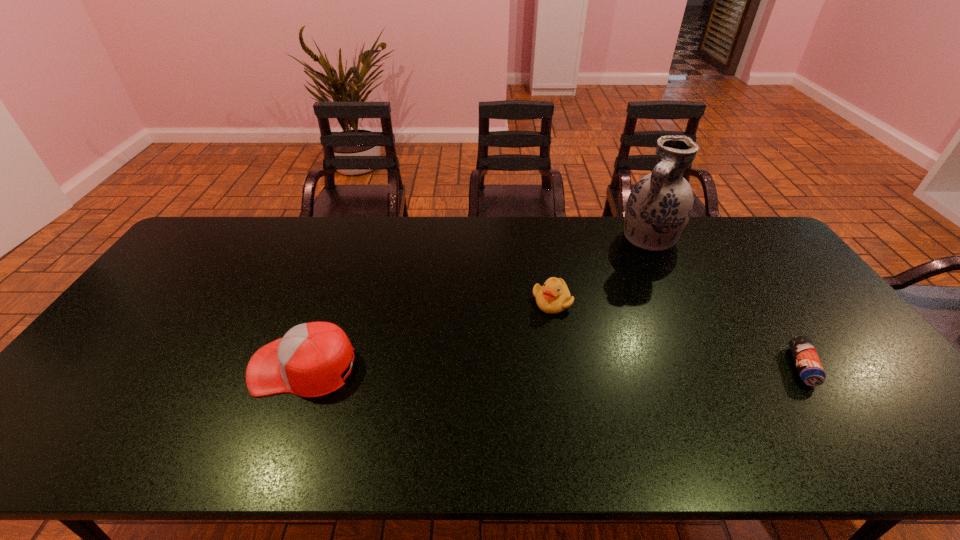
You are a GUI agent. You are given a task and a screenshot of the screen. Output one action in this format:
    pyautogui.click(x=<x>, y=<y>)
    Task: Click on the vacant area that lies between the tallest object and the third shortest object
    This screenshot has height=540, width=960.
    Given the screenshot: What is the action you would take?
    pyautogui.click(x=476, y=302)

You are a GUI agent. You are given a task and a screenshot of the screen. Output one action in this format:
    pyautogui.click(x=<x>, y=<y>)
    Task: Click on the vacant space in between the second farthest object and the shortest object
    
    Given the screenshot: What is the action you would take?
    pyautogui.click(x=677, y=334)

At what (x,y) coordinates should I click in order to perform the action: click on unoccupied position between the rightmost object and the vase. Please return your answer as a coordinate pair (x, y). The image size is (960, 540). Looking at the image, I should click on (726, 302).

You are a GUI agent. You are given a task and a screenshot of the screen. Output one action in this format:
    pyautogui.click(x=<x>, y=<y>)
    Task: Click on the vacant space that is in between the beer can and the second tallest object
    This screenshot has height=540, width=960.
    Given the screenshot: What is the action you would take?
    pyautogui.click(x=553, y=367)

Image resolution: width=960 pixels, height=540 pixels. In order to click on vacant space that is in between the farthest object and the third nearest object in this screenshot , I will do `click(601, 269)`.

In order to click on free spot between the farthest object and the shortest object in this screenshot , I will do `click(726, 302)`.

The width and height of the screenshot is (960, 540). Identify the location of vacant space that's between the baseball cap and the shortest object. (553, 367).

Select which object is the second closest to the baseball cap. Please provide its 2D coordinates. Your answer should be formatted as a tuple, i.e. [(x, y)], where the tuple contains the x and y coordinates of a point satisfying the conditions above.

[(659, 206)]

The width and height of the screenshot is (960, 540). Find the location of `object that ranks as the third closest to the vase`. object that ranks as the third closest to the vase is located at coordinates (308, 361).

You are a GUI agent. You are given a task and a screenshot of the screen. Output one action in this format:
    pyautogui.click(x=<x>, y=<y>)
    Task: Click on the vacant position in the image that satisfies the following two spatial constraints: 1. on the back side of the vase; 2. on the left side of the second shortest object
    Image resolution: width=960 pixels, height=540 pixels.
    Given the screenshot: What is the action you would take?
    pyautogui.click(x=540, y=238)